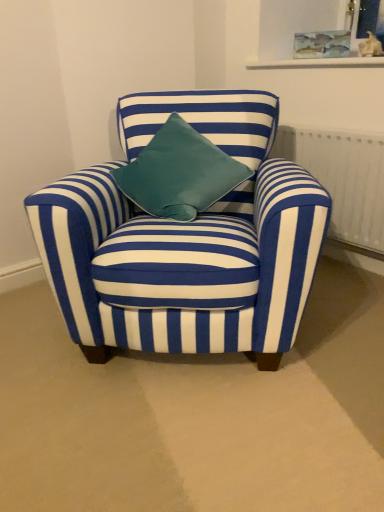
Question: Does white textured radiator at right have a greater height compared to blue striped fabric chair at center?

Choices:
 (A) yes
 (B) no

Answer: (B)

Question: Does white textured radiator at right turn towards blue striped fabric chair at center?

Choices:
 (A) yes
 (B) no

Answer: (A)

Question: Can you confirm if white textured radiator at right is wider than blue striped fabric chair at center?

Choices:
 (A) no
 (B) yes

Answer: (A)

Question: Does white textured radiator at right have a lesser width compared to blue striped fabric chair at center?

Choices:
 (A) yes
 (B) no

Answer: (A)

Question: Is white textured radiator at right turned away from blue striped fabric chair at center?

Choices:
 (A) no
 (B) yes

Answer: (A)

Question: Considering the positions of blue striped fabric chair at center and white textured radiator at right in the image, is blue striped fabric chair at center wider or thinner than white textured radiator at right?

Choices:
 (A) thin
 (B) wide

Answer: (B)

Question: Is blue striped fabric chair at center in front of or behind white textured radiator at right in the image?

Choices:
 (A) behind
 (B) front

Answer: (B)

Question: Is blue striped fabric chair at center situated inside white textured radiator at right or outside?

Choices:
 (A) outside
 (B) inside

Answer: (A)

Question: Is point (223, 278) closer or farther from the camera than point (327, 177)?

Choices:
 (A) farther
 (B) closer

Answer: (B)

Question: Does point (112, 180) appear closer or farther from the camera than point (337, 39)?

Choices:
 (A) closer
 (B) farther

Answer: (A)

Question: Would you say blue striped fabric chair at center is to the left or to the right of watercolor paper picture frame at upper center in the picture?

Choices:
 (A) left
 (B) right

Answer: (A)

Question: Would you say blue striped fabric chair at center is inside or outside watercolor paper picture frame at upper center?

Choices:
 (A) inside
 (B) outside

Answer: (B)

Question: From their relative heights in the image, would you say blue striped fabric chair at center is taller or shorter than watercolor paper picture frame at upper center?

Choices:
 (A) short
 (B) tall

Answer: (B)

Question: From a real-world perspective, is watercolor paper picture frame at upper center above or below white textured radiator at right?

Choices:
 (A) below
 (B) above

Answer: (B)

Question: In terms of height, does watercolor paper picture frame at upper center look taller or shorter compared to white textured radiator at right?

Choices:
 (A) short
 (B) tall

Answer: (A)